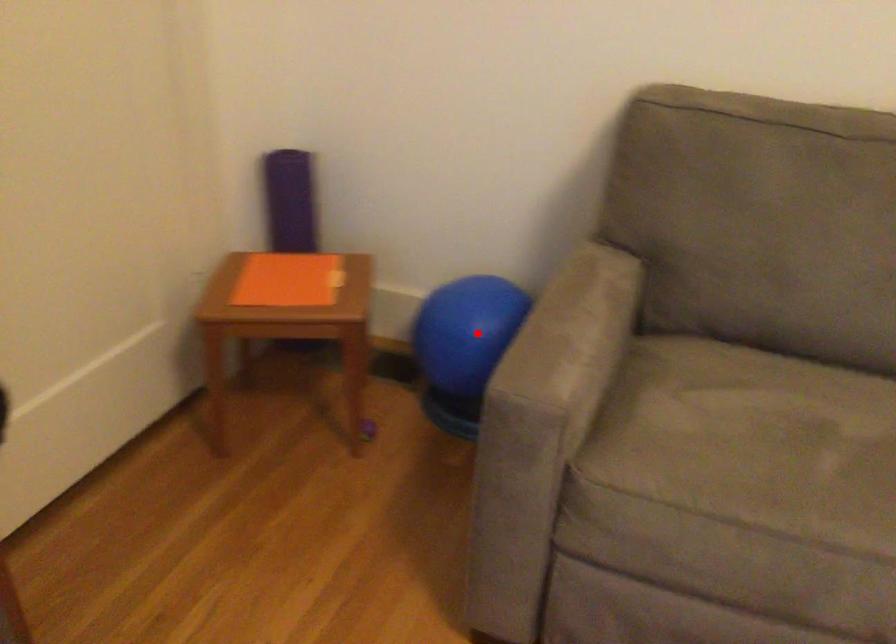
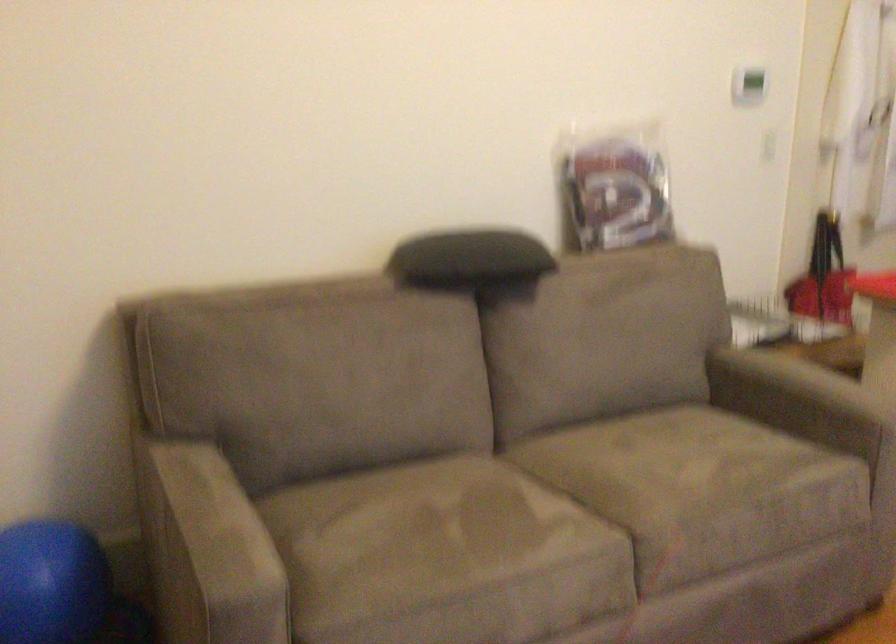
Find the pixel in the second image that matches the highlighted location in the first image.

(49, 583)